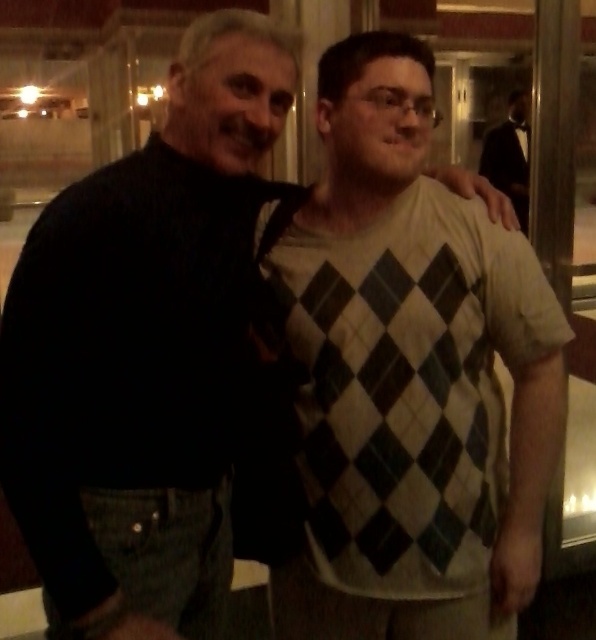
You are planning to rent a coat rack that requires coats to be hung with at least 10 cm of vertical space between them. You have two items to hang on the rack. The first is the argyle sweater at center, and the second is the black tuxedo at right. Can you determine if the vertical space between them will be sufficient?

The argyle sweater at center is shorter than the black tuxedo at right, so the vertical space between them would depend on their individual heights. However, since the required vertical space is 10 cm, and the difference in their heights isn

You are a photographer at a social event and need to place a name tag on the argyle sweater at center and the black tuxedo at right. According to the image, which clothing item is on the left side?

The argyle sweater at center is positioned on the left side of the black tuxedo at right, so the name tag for the argyle sweater at center should be placed on the left.